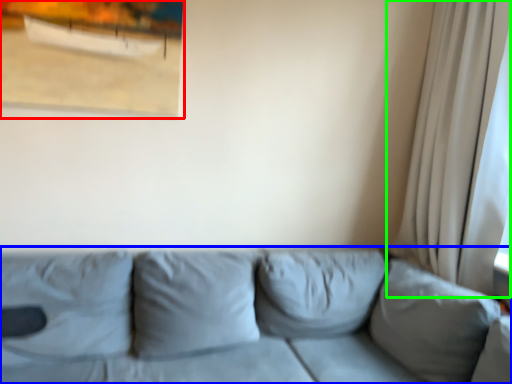
Question: Based on their relative distances, which object is nearer to picture frame (highlighted by a red box)? Choose from studio couch (highlighted by a blue box) and curtain (highlighted by a green box).

Choices:
 (A) studio couch
 (B) curtain

Answer: (A)